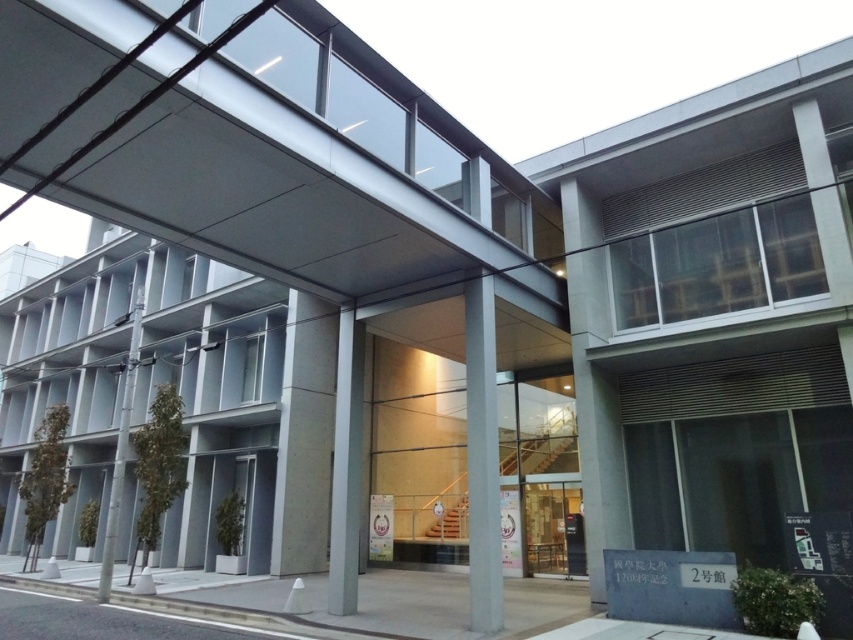
Is sleek concrete pillar at center smaller than gray concrete pillar at left?

Yes, sleek concrete pillar at center is smaller than gray concrete pillar at left.

Does sleek concrete pillar at center appear on the right side of gray concrete pillar at left?

Correct, you'll find sleek concrete pillar at center to the right of gray concrete pillar at left.

This screenshot has height=640, width=853. Describe the element at coordinates (482, 458) in the screenshot. I see `sleek concrete pillar at center` at that location.

Image resolution: width=853 pixels, height=640 pixels. Identify the location of sleek concrete pillar at center. (482, 458).

Does point (469, 515) come closer to viewer compared to point (341, 433)?

Yes, it is.

Is sleek concrete pillar at center to the left of smooth concrete pillar at center from the viewer's perspective?

Incorrect, sleek concrete pillar at center is not on the left side of smooth concrete pillar at center.

Who is more forward, (474, 337) or (350, 442)?

Point (474, 337) is in front.

Find the location of a particular element. This screenshot has height=640, width=853. sleek concrete pillar at center is located at coordinates (482, 458).

Can you confirm if smooth concrete pillar at center is positioned to the left of gray concrete pillar at left?

Incorrect, smooth concrete pillar at center is not on the left side of gray concrete pillar at left.

Locate an element on the screen. This screenshot has height=640, width=853. smooth concrete pillar at center is located at coordinates (346, 467).

In order to click on smooth concrete pillar at center in this screenshot , I will do `click(346, 467)`.